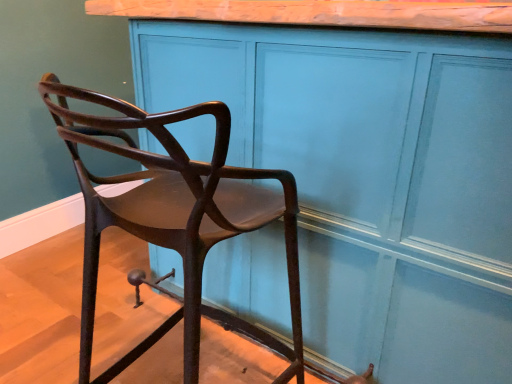
Question: Is matte brown chair at left in front of or behind matte wood cabinet at center in the image?

Choices:
 (A) front
 (B) behind

Answer: (A)

Question: Considering the positions of matte brown chair at left and matte wood cabinet at center in the image, is matte brown chair at left wider or thinner than matte wood cabinet at center?

Choices:
 (A) wide
 (B) thin

Answer: (B)

Question: From the image's perspective, is matte brown chair at left located above or below matte wood cabinet at center?

Choices:
 (A) above
 (B) below

Answer: (B)

Question: Is point (183, 91) positioned closer to the camera than point (280, 342)?

Choices:
 (A) closer
 (B) farther

Answer: (A)

Question: Choose the correct answer: Is matte wood cabinet at center inside matte brown chair at left or outside it?

Choices:
 (A) outside
 (B) inside

Answer: (A)

Question: In terms of width, does matte wood cabinet at center look wider or thinner when compared to matte brown chair at left?

Choices:
 (A) wide
 (B) thin

Answer: (A)

Question: Considering their positions, is matte wood cabinet at center located in front of or behind matte brown chair at left?

Choices:
 (A) front
 (B) behind

Answer: (B)